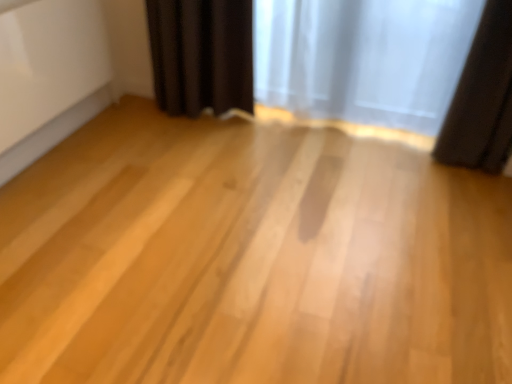
Question: Is translucent fabric curtain at upper right, positioned as the 2th curtain in right-to-left order, spatially inside dark matte curtain at right, which is the 1th curtain in right-to-left order, or outside of it?

Choices:
 (A) outside
 (B) inside

Answer: (A)

Question: From the image's perspective, is translucent fabric curtain at upper right, positioned as the 2th curtain in right-to-left order, above or below dark matte curtain at right, which is the 1th curtain in right-to-left order?

Choices:
 (A) below
 (B) above

Answer: (B)

Question: Is translucent fabric curtain at upper right, which is counted as the first curtain, starting from the left, in front of or behind dark matte curtain at right, which is the 1th curtain in right-to-left order, in the image?

Choices:
 (A) front
 (B) behind

Answer: (B)

Question: In the image, is dark matte curtain at right, the 2th curtain from the left, on the left side or the right side of translucent fabric curtain at upper right, positioned as the 2th curtain in right-to-left order?

Choices:
 (A) left
 (B) right

Answer: (B)

Question: In terms of width, does dark matte curtain at right, which is the 1th curtain in right-to-left order, look wider or thinner when compared to translucent fabric curtain at upper right, which is counted as the first curtain, starting from the left?

Choices:
 (A) thin
 (B) wide

Answer: (B)

Question: Does point (497, 57) appear closer or farther from the camera than point (437, 87)?

Choices:
 (A) farther
 (B) closer

Answer: (B)

Question: Is dark matte curtain at right, which is the 1th curtain in right-to-left order, taller or shorter than translucent fabric curtain at upper right, positioned as the 2th curtain in right-to-left order?

Choices:
 (A) short
 (B) tall

Answer: (B)